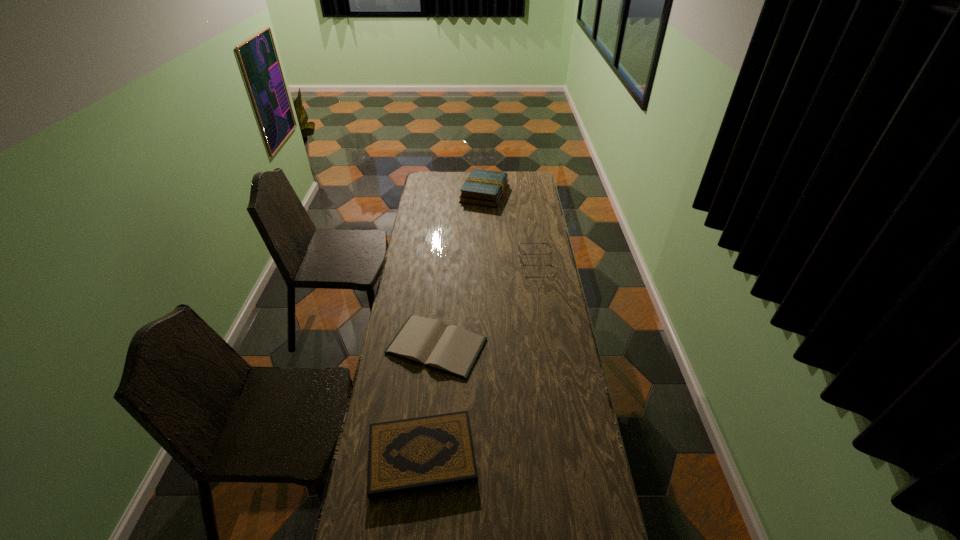
This screenshot has width=960, height=540. I want to click on free spot located on the front-facing side of the third shortest object, so pos(456,259).

You are a GUI agent. You are given a task and a screenshot of the screen. Output one action in this format:
    pyautogui.click(x=<x>, y=<y>)
    Task: Click on the vacant position located on the front-facing side of the third shortest object
    
    Given the screenshot: What is the action you would take?
    pyautogui.click(x=469, y=259)

Locate an element on the screen. The width and height of the screenshot is (960, 540). vacant space located on the right of the second tallest hardback book is located at coordinates (543, 456).

You are a GUI agent. You are given a task and a screenshot of the screen. Output one action in this format:
    pyautogui.click(x=<x>, y=<y>)
    Task: Click on the free space located 0.130m on the front of the second farthest hardback book
    The height and width of the screenshot is (540, 960).
    Given the screenshot: What is the action you would take?
    pyautogui.click(x=430, y=411)

Where is `object situated at the far edge`? This screenshot has width=960, height=540. object situated at the far edge is located at coordinates (482, 187).

Identify the location of object present at the right edge. 519,242.

Locate an element on the screen. vacant space at the left edge of the desktop is located at coordinates (430, 242).

Locate an element on the screen. vacant area at the right edge of the desktop is located at coordinates (605, 537).

The width and height of the screenshot is (960, 540). In order to click on free location at the far left corner of the desktop in this screenshot , I will do `click(424, 185)`.

Image resolution: width=960 pixels, height=540 pixels. I want to click on vacant region between the nearest object and the third shortest object, so click(x=479, y=357).